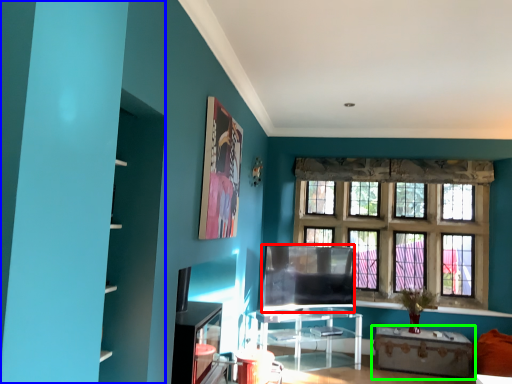
Question: Which object is the farthest from window screen (highlighted by a red box)? Choose among these: bookshelf (highlighted by a blue box) or table (highlighted by a green box).

Choices:
 (A) bookshelf
 (B) table

Answer: (A)